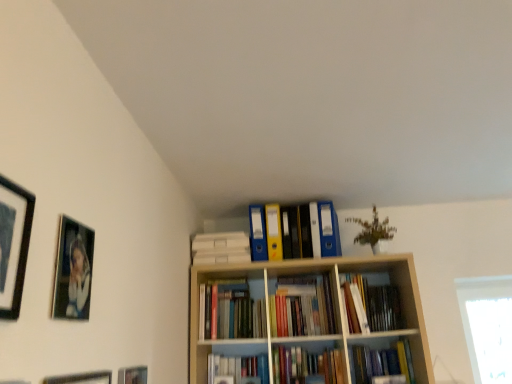
Question: Is matte black picture frame at upper left, positioned as the 1th picture frame in top-to-bottom order, aimed at hardcover book at center, the 1th book when ordered from bottom to top?

Choices:
 (A) yes
 (B) no

Answer: (B)

Question: Is matte black picture frame at upper left, positioned as the 1th picture frame in top-to-bottom order, at the right side of hardcover book at center, the 1th book when ordered from bottom to top?

Choices:
 (A) no
 (B) yes

Answer: (A)

Question: Is matte black picture frame at upper left, the 4th picture frame when ordered from bottom to top, taller than hardcover book at center, which appears as the 3th book when viewed from the top?

Choices:
 (A) yes
 (B) no

Answer: (A)

Question: Is matte black picture frame at upper left, the 4th picture frame when ordered from bottom to top, in contact with hardcover book at center, the 1th book when ordered from bottom to top?

Choices:
 (A) no
 (B) yes

Answer: (A)

Question: Is matte black picture frame at upper left, positioned as the 1th picture frame in top-to-bottom order, behind hardcover book at center, the 1th book when ordered from bottom to top?

Choices:
 (A) no
 (B) yes

Answer: (A)

Question: From the image's perspective, would you say matte black picture frame at upper left, the 4th picture frame when ordered from bottom to top, is shown under hardcover book at center, which appears as the 3th book when viewed from the top?

Choices:
 (A) no
 (B) yes

Answer: (A)

Question: Is matte black picture frame at lower left, which is the third picture frame in top-to-bottom order, oriented towards matte black picture frame at lower left, which is counted as the fourth picture frame, starting from the top?

Choices:
 (A) no
 (B) yes

Answer: (A)

Question: From the image's perspective, is matte black picture frame at lower left, which is the third picture frame in top-to-bottom order, over matte black picture frame at lower left, which is counted as the 1th picture frame, starting from the bottom?

Choices:
 (A) yes
 (B) no

Answer: (A)

Question: Considering the relative sizes of matte black picture frame at lower left, which is the 2th picture frame in bottom-to-top order, and matte black picture frame at lower left, which is counted as the 1th picture frame, starting from the bottom, in the image provided, is matte black picture frame at lower left, which is the 2th picture frame in bottom-to-top order, shorter than matte black picture frame at lower left, which is counted as the 1th picture frame, starting from the bottom,?

Choices:
 (A) yes
 (B) no

Answer: (A)

Question: Can you confirm if matte black picture frame at lower left, which is the third picture frame in top-to-bottom order, is thinner than matte black picture frame at lower left, which is counted as the fourth picture frame, starting from the top?

Choices:
 (A) no
 (B) yes

Answer: (B)

Question: Is matte black picture frame at lower left, which is the 2th picture frame in bottom-to-top order, bigger than matte black picture frame at lower left, which is counted as the 1th picture frame, starting from the bottom?

Choices:
 (A) no
 (B) yes

Answer: (A)

Question: Can you confirm if matte black picture frame at lower left, which is the 2th picture frame in bottom-to-top order, is positioned to the left of matte black picture frame at lower left, which is counted as the 1th picture frame, starting from the bottom?

Choices:
 (A) no
 (B) yes

Answer: (A)

Question: Considering the relative sizes of hardcover books at center, arranged as the second book when viewed from the top, and hardcover book at center, which appears as the 3th book when viewed from the top, in the image provided, is hardcover books at center, arranged as the second book when viewed from the top, shorter than hardcover book at center, which appears as the 3th book when viewed from the top,?

Choices:
 (A) yes
 (B) no

Answer: (B)